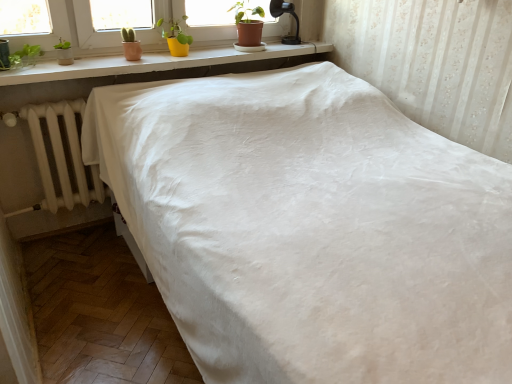
This screenshot has width=512, height=384. Describe the element at coordinates (153, 63) in the screenshot. I see `white painted wood at upper center` at that location.

Describe the element at coordinates (60, 157) in the screenshot. The image size is (512, 384). I see `white matte radiator at left` at that location.

What is the approximate width of white fabric bed at center?

2.15 meters.

Where is `white painted wood at upper center`? The height and width of the screenshot is (384, 512). white painted wood at upper center is located at coordinates (153, 63).

From the image's perspective, is white matte radiator at left on white painted wood at upper center?

Actually, white matte radiator at left appears below white painted wood at upper center in the image.

Does point (72, 158) come closer to viewer compared to point (82, 64)?

No, it is not.

Could you tell me if white matte radiator at left is turned towards white painted wood at upper center?

No, white matte radiator at left is not aimed at white painted wood at upper center.

Between black glass lamp at upper right and matte brown pot at upper center, the 1th houseplant viewed from the right, which one has larger size?

With larger size is matte brown pot at upper center, the 1th houseplant viewed from the right.

Which object is positioned more to the right, black glass lamp at upper right or matte brown pot at upper center, the second houseplant when ordered from left to right?

black glass lamp at upper right.

Does black glass lamp at upper right turn towards matte brown pot at upper center, the second houseplant when ordered from left to right?

No, black glass lamp at upper right does not turn towards matte brown pot at upper center, the second houseplant when ordered from left to right.

Is yellow matte pot at upper center, which is the second houseplant in right-to-left order, touching matte brown pot at upper center, the second houseplant when ordered from left to right?

No, yellow matte pot at upper center, which is the second houseplant in right-to-left order, is not next to matte brown pot at upper center, the second houseplant when ordered from left to right.

Is matte brown pot at upper center, the second houseplant when ordered from left to right, surrounded by yellow matte pot at upper center, which is the second houseplant in right-to-left order?

No.

Which is behind, point (156, 24) or point (240, 40)?

Positioned behind is point (240, 40).

Between white fabric bed at center and white painted wood at upper center, which one has larger size?

With larger size is white fabric bed at center.

Between point (263, 119) and point (251, 59), which one is positioned behind?

Point (251, 59)

From a real-world perspective, is white fabric bed at center physically located above or below white painted wood at upper center?

From a real-world perspective, white fabric bed at center is physically below white painted wood at upper center.

Is white painted wood at upper center at the back of white fabric bed at center?

No, white fabric bed at center is not facing away from white painted wood at upper center.

Would you say white matte radiator at left is to the left or to the right of matte brown pot at upper center, the second houseplant when ordered from left to right, in the picture?

In the image, white matte radiator at left appears on the left side of matte brown pot at upper center, the second houseplant when ordered from left to right.

Which of these two, white matte radiator at left or matte brown pot at upper center, the second houseplant when ordered from left to right, stands taller?

With more height is white matte radiator at left.

At what (x,y) coordinates should I click in order to perform the action: click on radiator beneath the matte brown pot at upper center, the 1th houseplant viewed from the right (from a real-world perspective). Please return your answer as a coordinate pair (x, y). This screenshot has width=512, height=384. Looking at the image, I should click on (60, 157).

Is white matte radiator at left inside the boundaries of matte brown pot at upper center, the 1th houseplant viewed from the right, or outside?

The correct answer is: outside.

From a real-world perspective, which is physically below, matte brown pot at upper center, the second houseplant when ordered from left to right, or white matte radiator at left?

In real-world perspective, white matte radiator at left is lower.

You are a GUI agent. You are given a task and a screenshot of the screen. Output one action in this format:
    pyautogui.click(x=<x>, y=<y>)
    Task: Click on the radiator below the matte brown pot at upper center, the second houseplant when ordered from left to right (from a real-world perspective)
    
    Given the screenshot: What is the action you would take?
    pyautogui.click(x=60, y=157)

Is matte brown pot at upper center, the 1th houseplant viewed from the right, further to the viewer compared to white matte radiator at left?

Yes.

In the scene shown: Can we say matte brown pot at upper center, the 1th houseplant viewed from the right, lies outside white matte radiator at left?

matte brown pot at upper center, the 1th houseplant viewed from the right, is positioned outside white matte radiator at left.

In terms of height, does white painted wood at upper center look taller or shorter compared to yellow matte pot at upper center, which is the second houseplant in right-to-left order?

→ Clearly, white painted wood at upper center is shorter compared to yellow matte pot at upper center, which is the second houseplant in right-to-left order.

From the image's perspective, who appears lower, white painted wood at upper center or yellow matte pot at upper center, which is the second houseplant in right-to-left order?

white painted wood at upper center appears lower in the image.

Which is in front, white painted wood at upper center or yellow matte pot at upper center, marked as the first houseplant in a left-to-right arrangement?

Positioned in front is white painted wood at upper center.

Is point (287, 57) closer or farther from the camera than point (170, 51)?

Point (287, 57) is farther from the camera than point (170, 51).

I want to click on window sill above the white matte radiator at left (from a real-world perspective), so click(153, 63).

Image resolution: width=512 pixels, height=384 pixels. In order to click on lamp behind the matte brown pot at upper center, the second houseplant when ordered from left to right in this screenshot , I will do `click(282, 14)`.

Looking at the image, which one is located closer to black glass lamp at upper right, yellow matte pot at upper center, marked as the first houseplant in a left-to-right arrangement, or white painted wood at upper center?

white painted wood at upper center is closer to black glass lamp at upper right.

Consider the image. Which object lies nearer to the anchor point white fabric bed at center, yellow matte pot at upper center, which is the second houseplant in right-to-left order, or white painted wood at upper center?

white painted wood at upper center.

Which object lies further to the anchor point white painted wood at upper center, matte brown pot at upper center, the second houseplant when ordered from left to right, or yellow matte pot at upper center, which is the second houseplant in right-to-left order?

matte brown pot at upper center, the second houseplant when ordered from left to right, is further to white painted wood at upper center.

Which object lies further to the anchor point white fabric bed at center, yellow matte pot at upper center, which is the second houseplant in right-to-left order, or white matte radiator at left?

yellow matte pot at upper center, which is the second houseplant in right-to-left order, is further to white fabric bed at center.

From the image, which object appears to be nearer to white matte radiator at left, black glass lamp at upper right or white fabric bed at center?

white fabric bed at center.

Looking at the image, which one is located closer to white painted wood at upper center, yellow matte pot at upper center, which is the second houseplant in right-to-left order, or white fabric bed at center?

yellow matte pot at upper center, which is the second houseplant in right-to-left order.

Based on their spatial positions, is white fabric bed at center or white matte radiator at left closer to matte brown pot at upper center, the 1th houseplant viewed from the right?

white fabric bed at center.

Estimate the real-world distances between objects in this image. Which object is further from yellow matte pot at upper center, which is the second houseplant in right-to-left order, black glass lamp at upper right or white matte radiator at left?

white matte radiator at left lies further to yellow matte pot at upper center, which is the second houseplant in right-to-left order, than the other object.

This screenshot has height=384, width=512. I want to click on radiator between white fabric bed at center and yellow matte pot at upper center, marked as the first houseplant in a left-to-right arrangement, along the z-axis, so click(x=60, y=157).

Where is `window sill between white fabric bed at center and matte brown pot at upper center, the 1th houseplant viewed from the right, in the front-back direction`? This screenshot has height=384, width=512. window sill between white fabric bed at center and matte brown pot at upper center, the 1th houseplant viewed from the right, in the front-back direction is located at coordinates (153, 63).

This screenshot has height=384, width=512. Identify the location of houseplant situated between yellow matte pot at upper center, which is the second houseplant in right-to-left order, and black glass lamp at upper right from left to right. (248, 23).

At what (x,y) coordinates should I click in order to perform the action: click on window sill between yellow matte pot at upper center, marked as the first houseplant in a left-to-right arrangement, and white matte radiator at left, in the vertical direction. Please return your answer as a coordinate pair (x, y). Looking at the image, I should click on (153, 63).